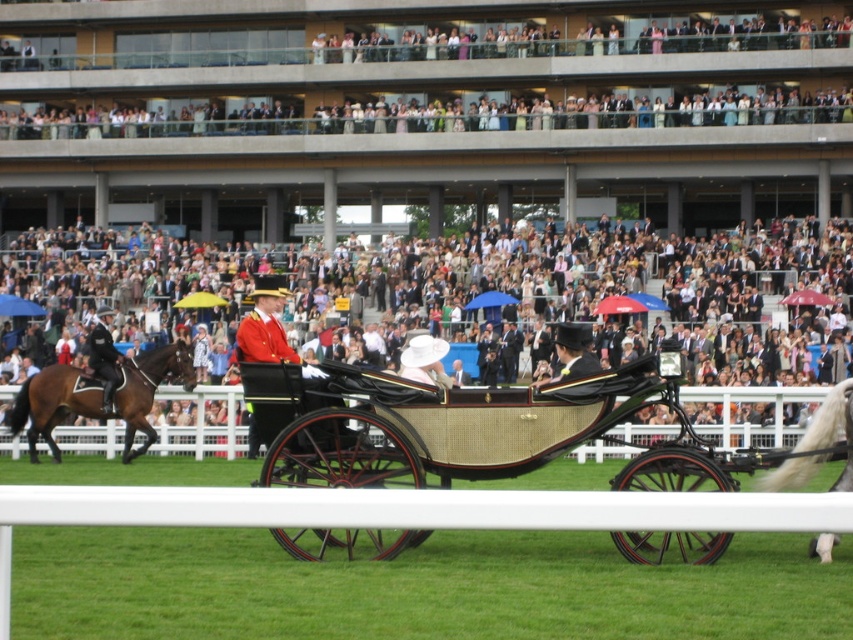
Question: Can you confirm if white silky horse at right is positioned above shiny black uniform at left?

Choices:
 (A) no
 (B) yes

Answer: (A)

Question: Is rattan/wooden wagon at center behind white silky horse at right?

Choices:
 (A) yes
 (B) no

Answer: (A)

Question: Considering the relative positions of brown glossy horse at left and shiny black uniform at left in the image provided, where is brown glossy horse at left located with respect to shiny black uniform at left?

Choices:
 (A) above
 (B) below

Answer: (B)

Question: Estimate the real-world distances between objects in this image. Which object is farther from the light beige fabric crowd at center?

Choices:
 (A) rattan/wooden wagon at center
 (B) brown glossy horse at left

Answer: (A)

Question: Which point appears farthest from the camera in this image?

Choices:
 (A) (712, 307)
 (B) (538, 445)

Answer: (A)

Question: Among these points, which one is nearest to the camera?

Choices:
 (A) (189, 349)
 (B) (788, 476)
 (C) (117, 355)

Answer: (B)